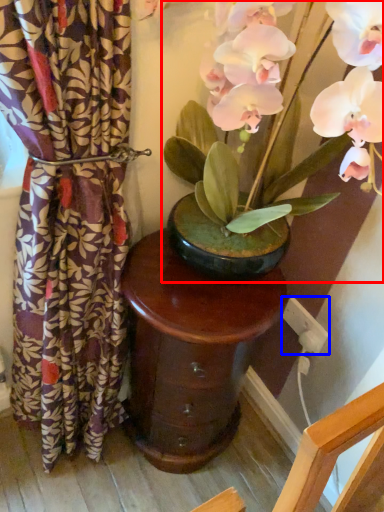
Question: Which of the following is the closest to the observer, houseplant (highlighted by a red box) or electric outlet (highlighted by a blue box)?

Choices:
 (A) houseplant
 (B) electric outlet

Answer: (A)